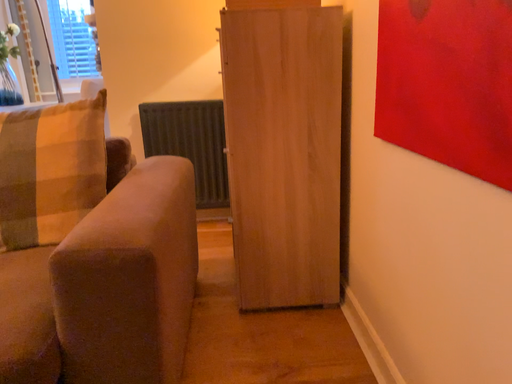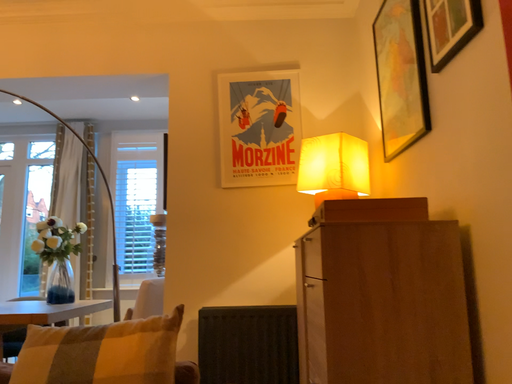
Question: Which way did the camera rotate in the video?

Choices:
 (A) rotated downward
 (B) rotated upward

Answer: (B)